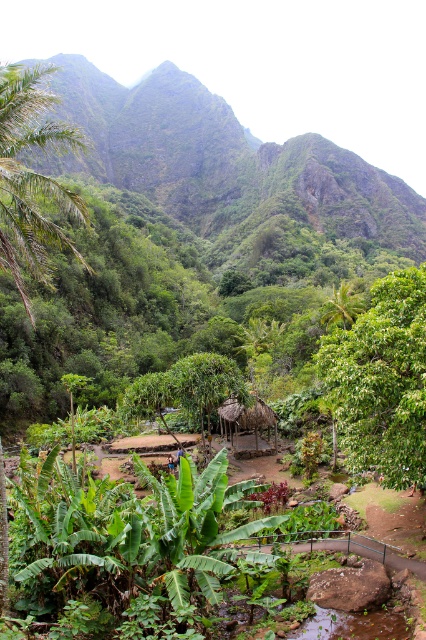
Based on the photo, you are a hiker who wants to take a photo of the green leafy tree at center from exactly 10 meters away. Based on the scene description, can you position yourself close enough to the tree to take the photo?

The green leafy tree at center is 13.92 meters from camera, so yes, you can move 3.92 meters closer to the tree to be within 10 meters for the photo.

You are standing at the point marked by the coordinates point (31,177) in the image. Looking around, you see the green leafy palm tree at left. Which direction should you walk to reach the rustic thatched roof hut mentioned in the scene description?

The point (31,177) corresponds to the green leafy palm tree at left. To reach the rustic thatched roof hut nestled among the trees, you should walk towards the center or right direction as the hut is positioned further along the path from the palm tree.

Consider the image. You are standing on the path leading to the rustic hut and notice two green leafy palm trees. Which one, the green leafy palm tree at left or the green leafy palm tree at center, is closer to you?

The green leafy palm tree at left is closer to you because it is positioned in front of the green leafy palm tree at center.